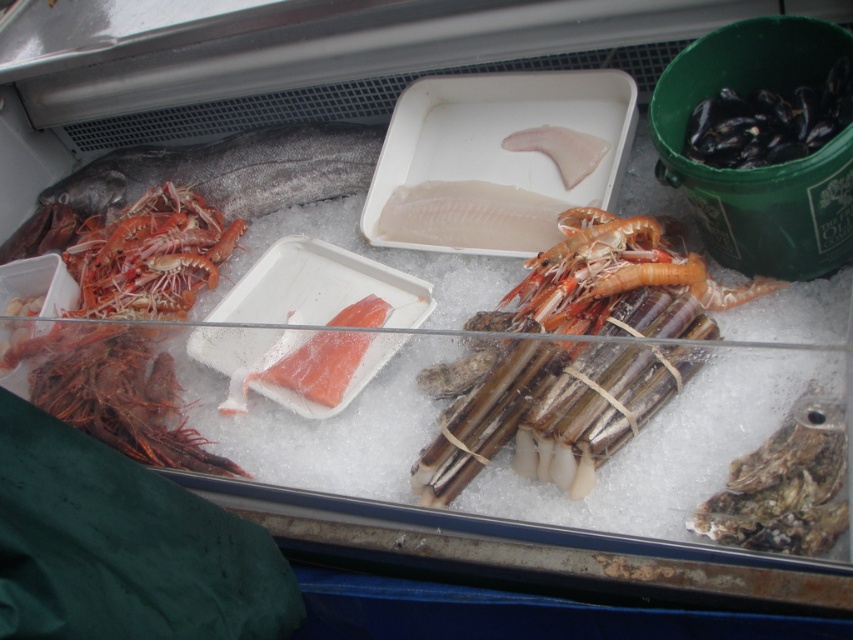
Image resolution: width=853 pixels, height=640 pixels. What do you see at coordinates (547, 413) in the screenshot? I see `shiny orange shrimp at center` at bounding box center [547, 413].

Which is in front, point (647, 294) or point (105, 296)?

Positioned in front is point (647, 294).

Locate an element on the screen. shiny orange shrimp at center is located at coordinates (547, 413).

Is dark gray/silver fish at left below shiny orange prawns at left?

No, dark gray/silver fish at left is not below shiny orange prawns at left.

The width and height of the screenshot is (853, 640). What do you see at coordinates (231, 170) in the screenshot? I see `dark gray/silver fish at left` at bounding box center [231, 170].

Identify the location of dark gray/silver fish at left. The image size is (853, 640). (231, 170).

This screenshot has height=640, width=853. In order to click on dark gray/silver fish at left in this screenshot , I will do (x=231, y=170).

Can you confirm if shiny orange shrimp at center is bigger than dark gray/silver fish at left?

Indeed, shiny orange shrimp at center has a larger size compared to dark gray/silver fish at left.

Is shiny orange shrimp at center above dark gray/silver fish at left?

Incorrect, shiny orange shrimp at center is not positioned above dark gray/silver fish at left.

Is point (541, 396) farther from viewer compared to point (358, 177)?

No, (541, 396) is closer to viewer.

Identify the location of shiny orange shrimp at center. (547, 413).